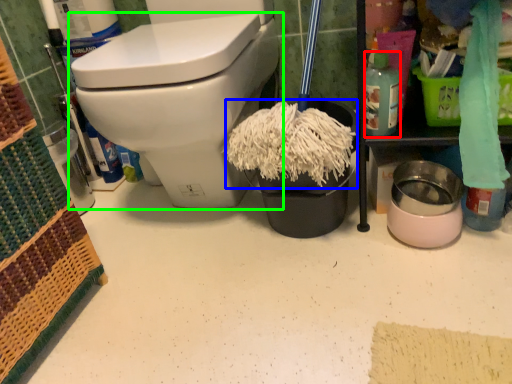
Question: Which object is positioned farthest from cleaning product (highlighted by a red box)? Select from debris (highlighted by a blue box) and toilet (highlighted by a green box).

Choices:
 (A) debris
 (B) toilet

Answer: (B)